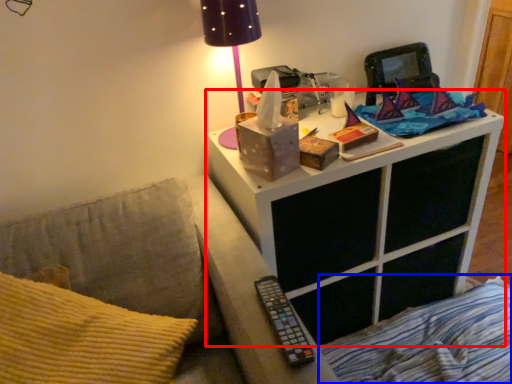
Question: Which object is further to the camera taking this photo, nightstand (highlighted by a red box) or bedding (highlighted by a blue box)?

Choices:
 (A) nightstand
 (B) bedding

Answer: (B)